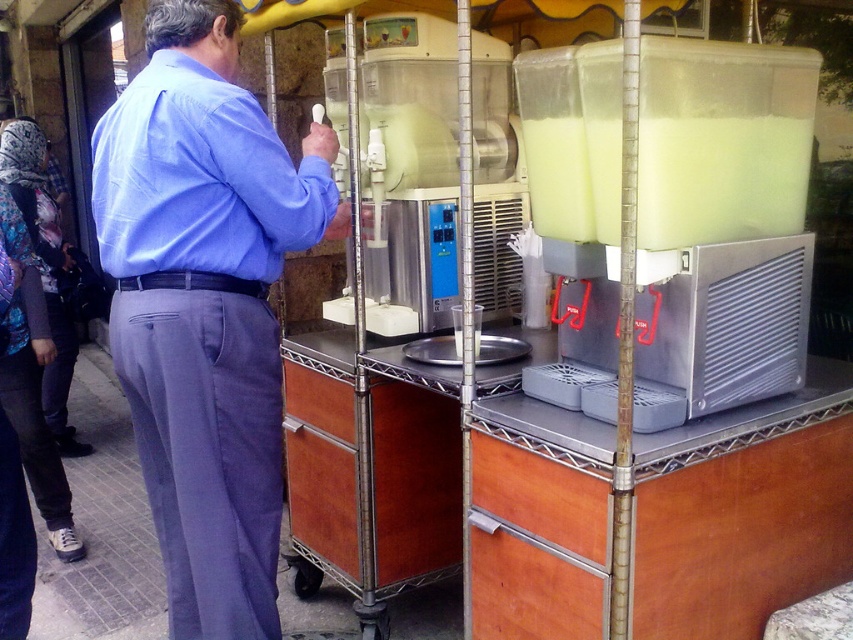
The height and width of the screenshot is (640, 853). In order to click on blue cotton shirt at upper left in this screenshot , I will do `click(206, 305)`.

Between blue cotton shirt at upper left and translucent plastic blender at center, which one appears on the right side from the viewer's perspective?

From the viewer's perspective, translucent plastic blender at center appears more on the right side.

Which is behind, point (199, 182) or point (447, 150)?

The point (447, 150) is more distant.

At what (x,y) coordinates should I click in order to perform the action: click on blue cotton shirt at upper left. Please return your answer as a coordinate pair (x, y). The height and width of the screenshot is (640, 853). Looking at the image, I should click on (206, 305).

Which is more to the right, translucent plastic blender at right or translucent plastic blender at center?

translucent plastic blender at right is more to the right.

Between translucent plastic blender at right and translucent plastic blender at center, which one appears on the left side from the viewer's perspective?

From the viewer's perspective, translucent plastic blender at center appears more on the left side.

This screenshot has width=853, height=640. What do you see at coordinates (720, 225) in the screenshot?
I see `translucent plastic blender at right` at bounding box center [720, 225].

Locate an element on the screen. translucent plastic blender at right is located at coordinates (720, 225).

Who is positioned more to the right, translucent plastic blender at center or translucent plastic container at right?

translucent plastic container at right is more to the right.

Who is lower down, translucent plastic blender at center or translucent plastic container at right?

translucent plastic container at right

Who is more distant from viewer, (444, 128) or (637, 225)?

Positioned behind is point (444, 128).

Identify the location of translucent plastic blender at center. Image resolution: width=853 pixels, height=640 pixels. (415, 161).